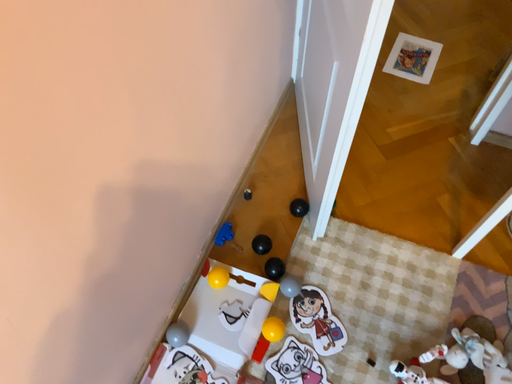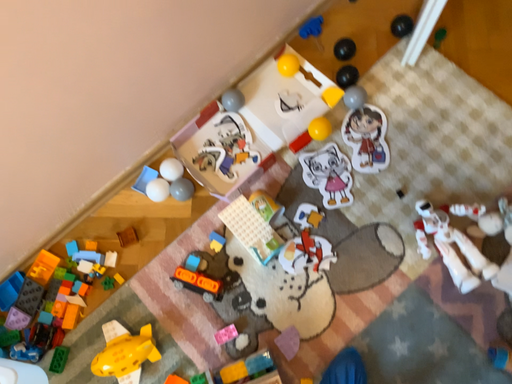
Question: How did the camera likely rotate when shooting the video?

Choices:
 (A) rotated right
 (B) rotated left

Answer: (B)